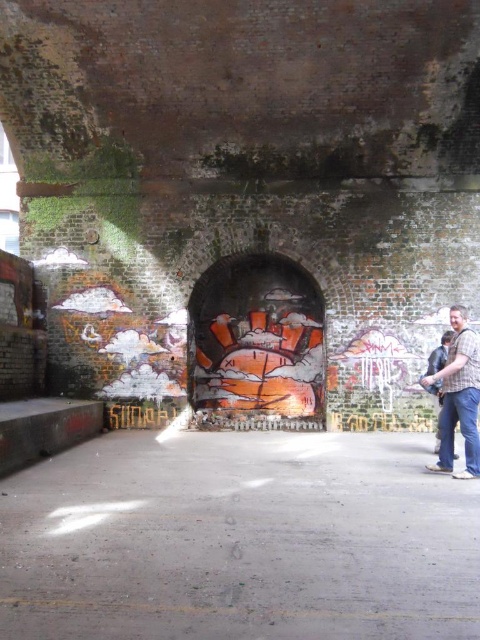
Which is above, matte brown jacket at right or plaid shirt at right?

plaid shirt at right is higher up.

Between matte brown jacket at right and plaid shirt at right, which one appears on the right side from the viewer's perspective?

Positioned to the right is plaid shirt at right.

Which is behind, point (454, 317) or point (442, 346)?

Positioned behind is point (442, 346).

I want to click on matte brown jacket at right, so click(x=458, y=396).